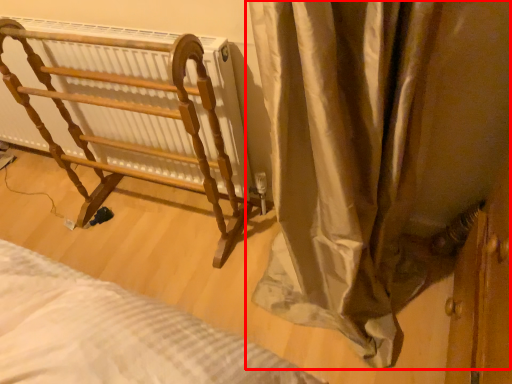
Question: From the image's perspective, where is curtain (annotated by the red box) located relative to furniture?

Choices:
 (A) below
 (B) above

Answer: (A)